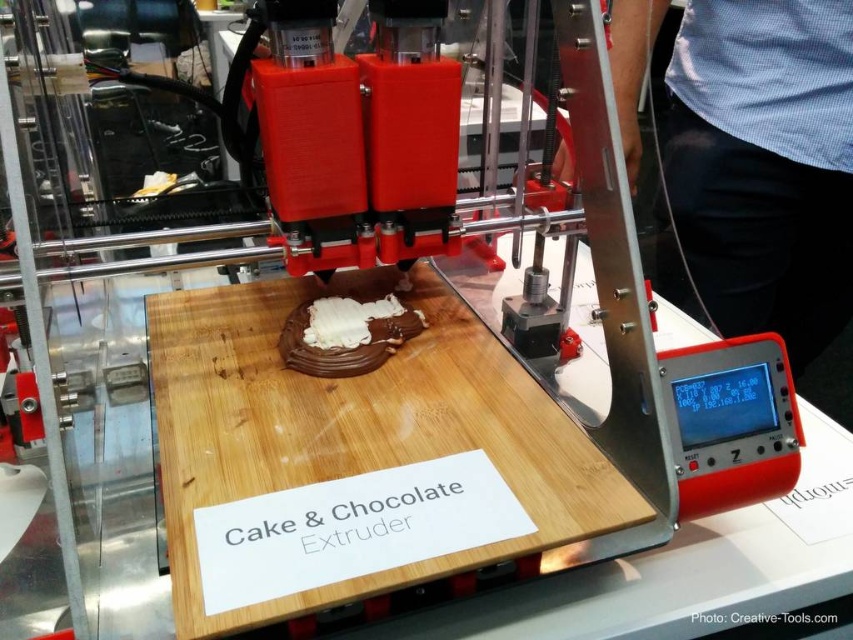
Does wooden cutting board at center have a lesser height compared to white glossy frosting at center?

In fact, wooden cutting board at center may be taller than white glossy frosting at center.

Is point (340, 440) positioned in front of point (337, 296)?

Yes, it is in front of point (337, 296).

Where is `wooden cutting board at center`? This screenshot has height=640, width=853. wooden cutting board at center is located at coordinates (354, 429).

Between chocolate matte at center and white glossy frosting at center, which one appears on the right side from the viewer's perspective?

From the viewer's perspective, white glossy frosting at center appears more on the right side.

In the scene shown: Is chocolate matte at center positioned in front of white glossy frosting at center?

Yes, it is in front of white glossy frosting at center.

Is point (334, 353) positioned before point (322, 337)?

Yes, it is in front of point (322, 337).

Locate an element on the screen. This screenshot has height=640, width=853. chocolate matte at center is located at coordinates (341, 342).

Can you confirm if wooden cutting board at center is positioned below chocolate matte at center?

Indeed, wooden cutting board at center is positioned under chocolate matte at center.

Who is more forward, [225,371] or [292,336]?

Point [225,371] is more forward.

I want to click on wooden cutting board at center, so [354, 429].